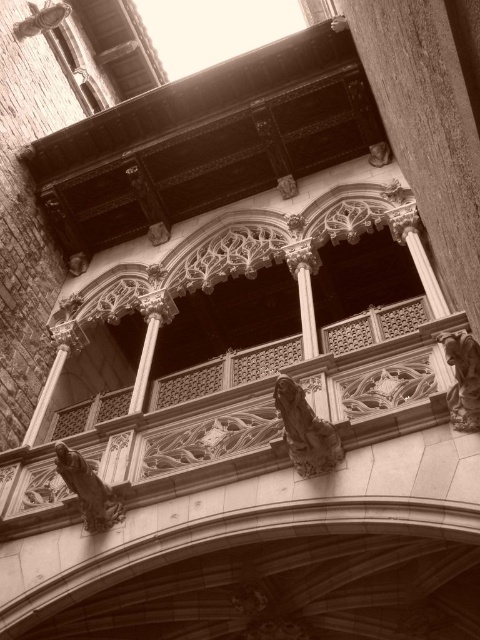
Question: Is dark stone gargoyle at lower left positioned behind metallic glass at upper left?

Choices:
 (A) yes
 (B) no

Answer: (B)

Question: Which object appears farthest from the camera in this image?

Choices:
 (A) polished stone statue at right
 (B) dark stone gargoyle at lower left
 (C) stone statue at center

Answer: (B)

Question: Does dark stone gargoyle at lower left have a lesser width compared to smooth stone column at center?

Choices:
 (A) no
 (B) yes

Answer: (B)

Question: Can you confirm if dark stone gargoyle at lower left is smaller than smooth stone column at center?

Choices:
 (A) yes
 (B) no

Answer: (A)

Question: Which point is farther to the camera?

Choices:
 (A) dark stone gargoyle at lower left
 (B) polished stone statue at right
 (C) metallic glass at upper left

Answer: (C)

Question: Which object is the farthest from the dark stone gargoyle at lower left?

Choices:
 (A) stone statue at center
 (B) metallic glass at upper left
 (C) polished stone statue at right

Answer: (B)